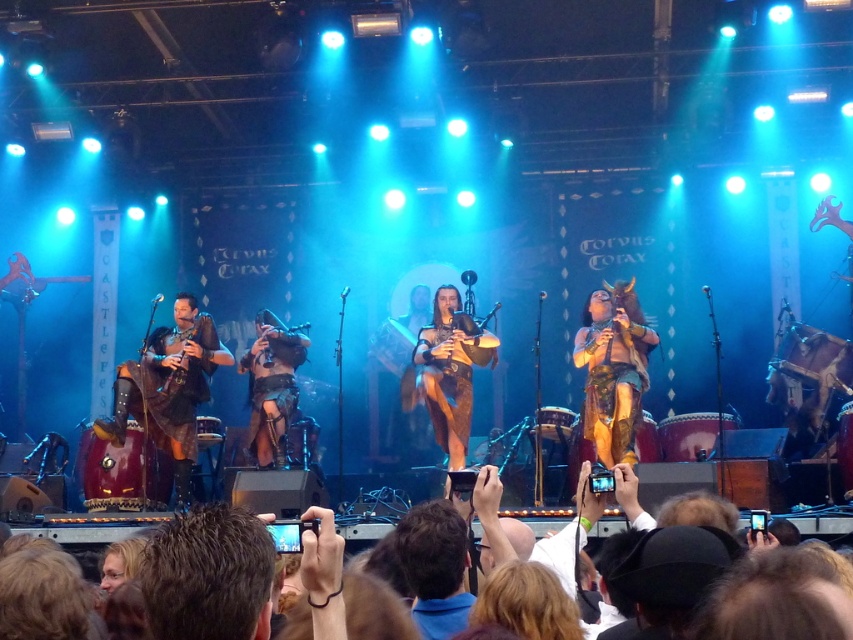
You are a stagehand who needs to adjust the lighting for the leather bagpipes at left and wooden bagpipes at left. Since you can only focus the spotlight on one set of bagpipes at a time, which one should you choose if you want to highlight the lower instrument?

The leather bagpipes at left is below wooden bagpipes at left, so to highlight the lower instrument, focus the spotlight on the leather bagpipes at left.

You are a photographer trying to capture the band members on stage. You notice two points marked on the stage floor. The first point is at position point (x=154, y=436) and the second is at point (x=637, y=348). Which point is closer to your camera lens?

Point (x=154, y=436) is closer to the viewer than point (x=637, y=348), so the first point is closer to your camera lens.